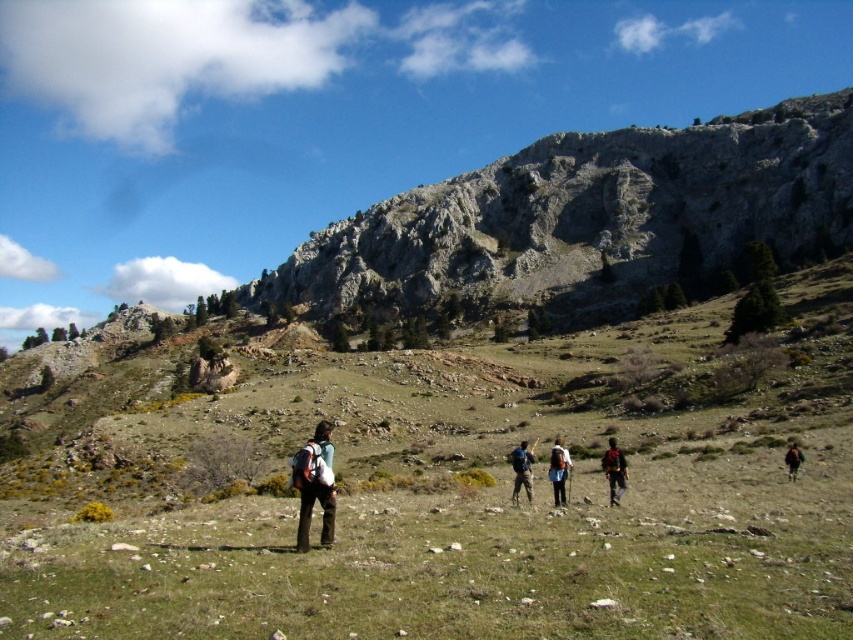
Which is more to the left, rocky gray mountain at upper center or dark brown backpack at center?

rocky gray mountain at upper center is more to the left.

Is rocky gray mountain at upper center closer to camera compared to dark brown backpack at center?

No, it is not.

Who is more forward, (648,236) or (793,449)?

Positioned in front is point (793,449).

The width and height of the screenshot is (853, 640). Identify the location of rocky gray mountain at upper center. (589, 220).

Who is positioned more to the right, green grassy field at center or matte black backpack at center?

From the viewer's perspective, matte black backpack at center appears more on the right side.

Find the location of `green grassy field at center`. green grassy field at center is located at coordinates (442, 492).

Who is lower down, dark red backpack at center or matte blue backpack at center?

matte blue backpack at center

Is point (621, 492) behind point (520, 474)?

That is False.

Locate an element on the screen. The height and width of the screenshot is (640, 853). dark red backpack at center is located at coordinates (614, 470).